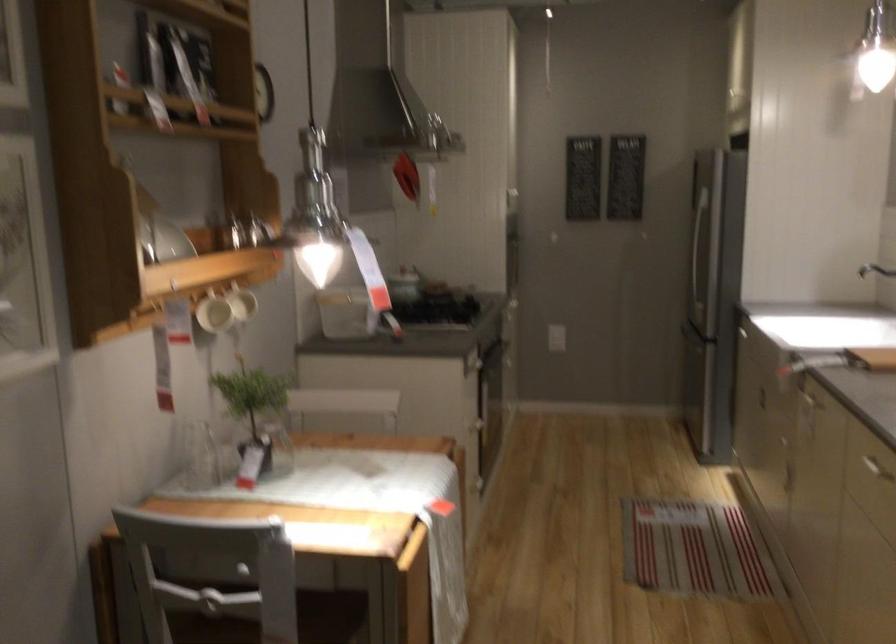
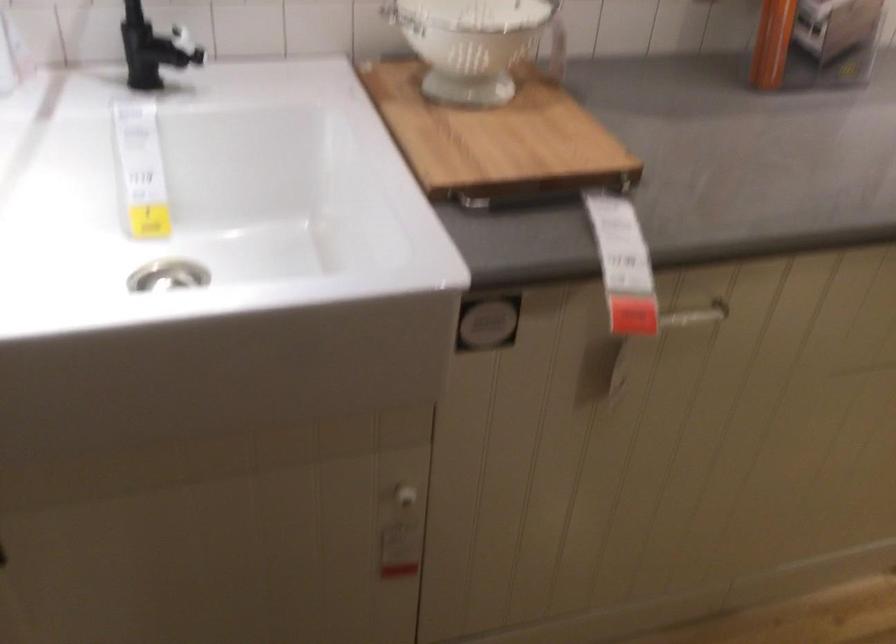
The point at (x=825, y=402) is marked in the first image. Where is the corresponding point in the second image?

(695, 315)